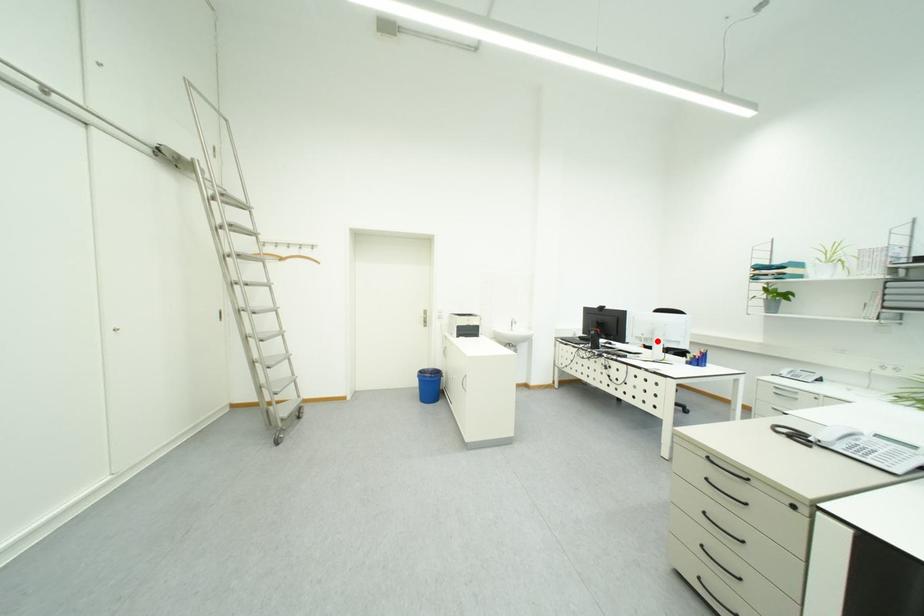
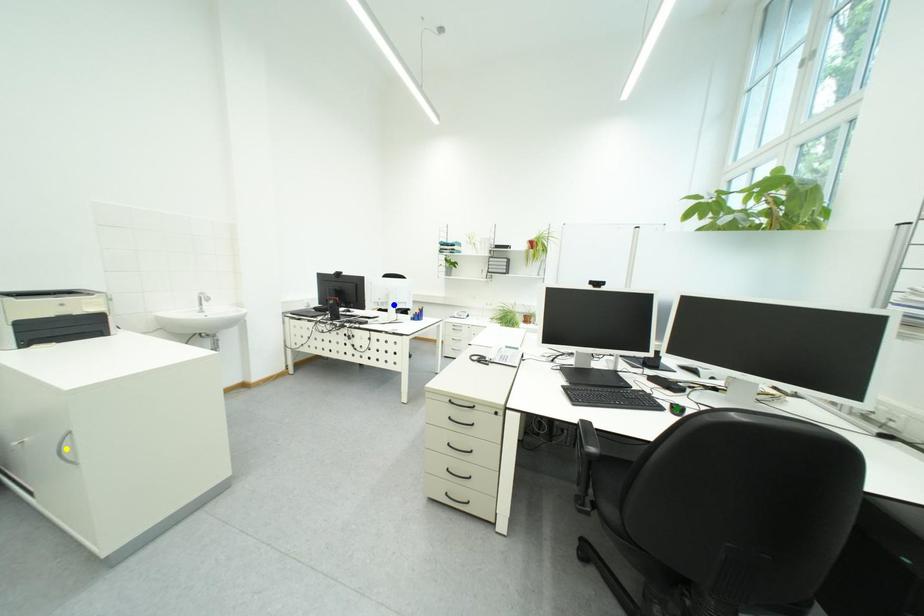
Question: I am providing you with two images of the same scene from different viewpoints. A red point is marked on the first image. You are given multiple points on the second image. Which spot in image 2 lines up with the point in image 1?

Choices:
 (A) blue point
 (B) yellow point
 (C) green point

Answer: (A)